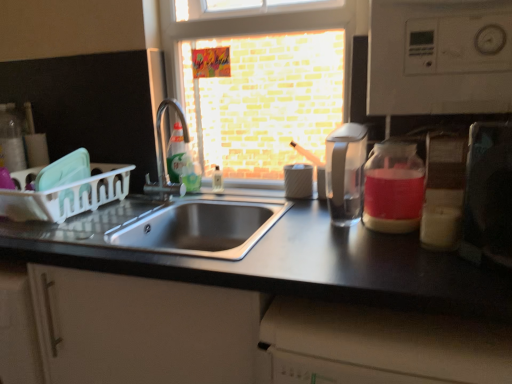
Question: Based on their positions, is brick wall at center located to the left or right of metallic silver toaster at right?

Choices:
 (A) right
 (B) left

Answer: (B)

Question: Is brick wall at center situated inside metallic silver toaster at right or outside?

Choices:
 (A) outside
 (B) inside

Answer: (A)

Question: Which object is the closest to the satin nickel faucet at sink left?

Choices:
 (A) metallic silver toaster at right
 (B) white plastic dish rack at left
 (C) pink translucent glass jar at right
 (D) brick wall at center
 (E) translucent green liquid at sink left, the 1th bottle in the right-to-left sequence

Answer: (E)

Question: Based on their relative distances, which object is nearer to the green plastic bottle at sink, positioned as the 1th bottle in left-to-right order?

Choices:
 (A) metallic stainless steel sink at center
 (B) translucent green liquid at sink left, the 2th bottle positioned from the left
 (C) transparent plastic coffee machine at center
 (D) brick wall at center
 (E) white plastic dish rack at left

Answer: (B)